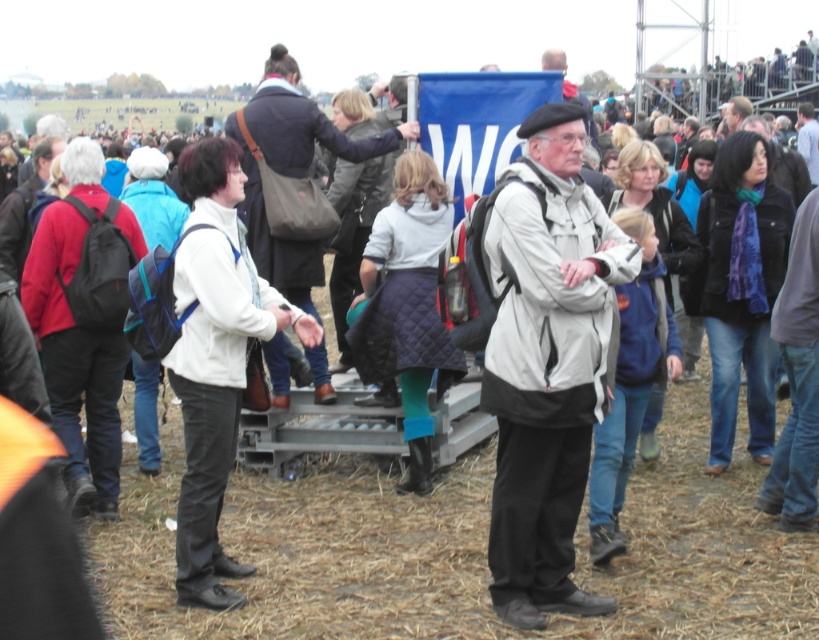
You are attending an outdoor event and see two jackets on the stage platform. The white quilted jacket at center and the light gray jacket at center. Which jacket is positioned to the left of the other?

The white quilted jacket at center is to the left of the light gray jacket at center.

You are attending a festival and notice two jackets on the stage platform. The white quilted jacket at center and the light gray jacket at center. Which jacket is shorter in height?

The white quilted jacket at center is shorter in height compared to the light gray jacket at center.

You are a photographer standing in the crowd at the event. You want to take a photo of the white matte jacket at center and the white quilted jacket at center. Which jacket will appear larger in your photo?

The white matte jacket at center will appear larger in the photo because it is closer to the viewer than the white quilted jacket at center.